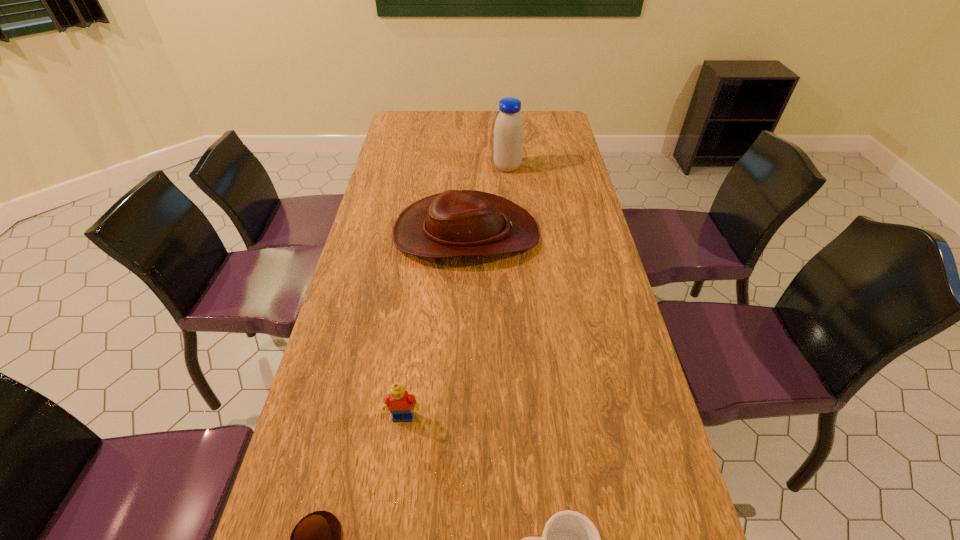
In the image, there is a desktop. Where is `free space at the right edge`? free space at the right edge is located at coordinates (621, 340).

Locate an element on the screen. The height and width of the screenshot is (540, 960). blank space at the far left corner is located at coordinates (411, 112).

At what (x,y) coordinates should I click in order to perform the action: click on free space at the far right corner of the desktop. Please return your answer as a coordinate pair (x, y). The image size is (960, 540). Looking at the image, I should click on (547, 121).

This screenshot has width=960, height=540. What are the coordinates of `empty space that is in between the cowboy hat and the third nearest object` in the screenshot? It's located at (435, 325).

I want to click on unoccupied position between the cowboy hat and the third farthest object, so click(x=435, y=325).

In order to click on empty space that is in between the third nearest object and the fourth nearest object in this screenshot , I will do `click(435, 325)`.

Locate which object is the third closest to the mug. Please provide its 2D coordinates. Your answer should be formatted as a tuple, i.e. [(x, y)], where the tuple contains the x and y coordinates of a point satisfying the conditions above.

[(455, 223)]

Point out which object is positioned as the second nearest to the mug. Please provide its 2D coordinates. Your answer should be formatted as a tuple, i.e. [(x, y)], where the tuple contains the x and y coordinates of a point satisfying the conditions above.

[(315, 539)]

What are the coordinates of `vacant region that satisfies the following two spatial constraints: 1. on the front-facing side of the fourth nearest object; 2. on the face of the third nearest object` in the screenshot? It's located at (460, 416).

Find the location of `free location that satisfies the following two spatial constraints: 1. on the front-facing side of the fourth nearest object; 2. on the face of the third nearest object`. free location that satisfies the following two spatial constraints: 1. on the front-facing side of the fourth nearest object; 2. on the face of the third nearest object is located at coordinates pyautogui.click(x=460, y=416).